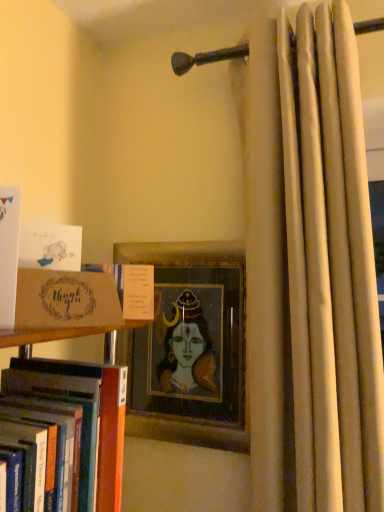
Question: From a real-world perspective, is brown cardboard box at left, the second book ordered from the bottom, positioned above or below white matte card at upper left, marked as the fourth book in a bottom-to-top arrangement?

Choices:
 (A) above
 (B) below

Answer: (B)

Question: Is brown cardboard box at left, placed as the third book when sorted from top to bottom, spatially inside white matte card at upper left, marked as the fourth book in a bottom-to-top arrangement, or outside of it?

Choices:
 (A) outside
 (B) inside

Answer: (A)

Question: Estimate the real-world distances between objects in this image. Which object is closer to the white matte card at left, arranged as the 2th book when viewed from the top?

Choices:
 (A) wooden picture frame at center
 (B) white matte card at upper left, which ranks as the 1th book in top-to-bottom order
 (C) hardcover book at center, marked as the 1th book in a bottom-to-top arrangement
 (D) beige fabric curtain at right
 (E) matte brown card at left

Answer: (E)

Question: Based on their relative distances, which object is nearer to the brown cardboard box at left, the second book ordered from the bottom?

Choices:
 (A) matte brown card at left
 (B) hardcover book at center, arranged as the 4th book when viewed from the top
 (C) white matte card at left, arranged as the 2th book when viewed from the top
 (D) white matte card at upper left, marked as the fourth book in a bottom-to-top arrangement
 (E) wooden picture frame at center

Answer: (A)